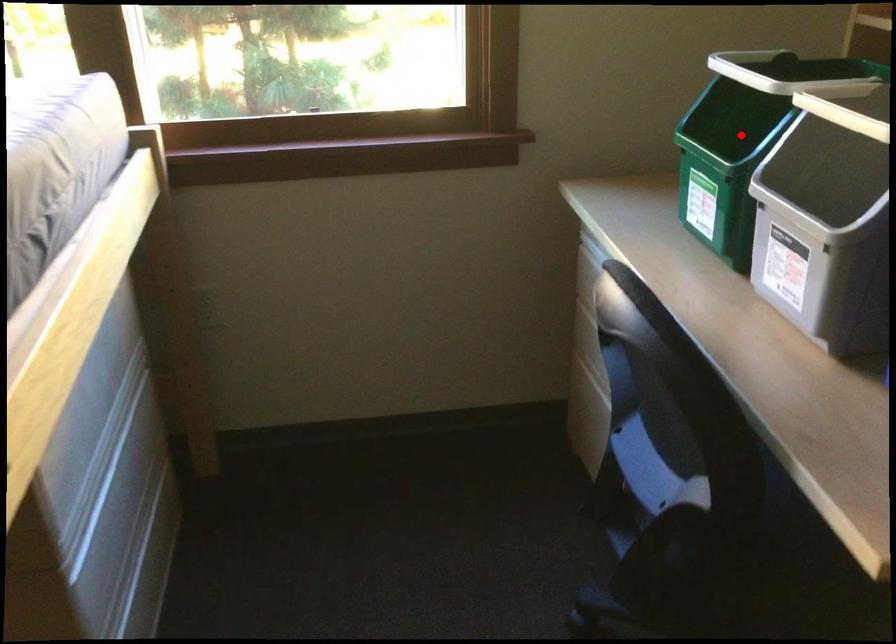
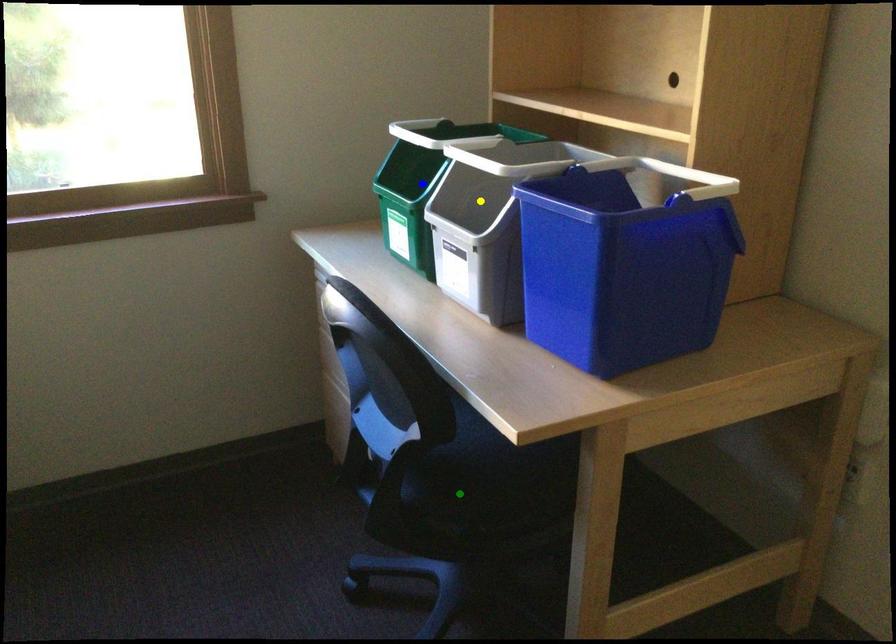
Question: I am providing you with two images of the same scene from different viewpoints. A red point is marked on the first image. You are given multiple points on the second image. In image 2, which mark is for the same physical point as the one in image 1?

Choices:
 (A) yellow point
 (B) green point
 (C) blue point

Answer: (C)